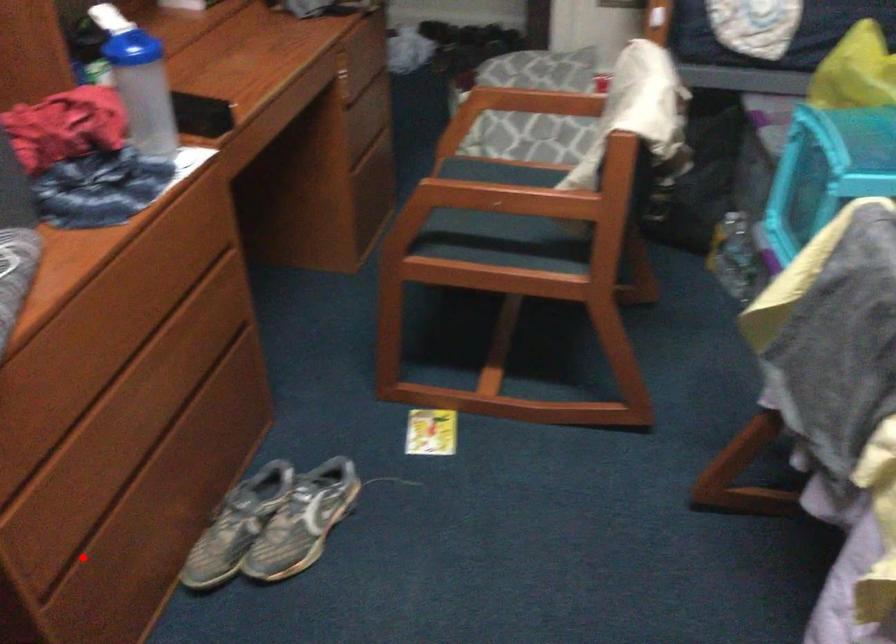
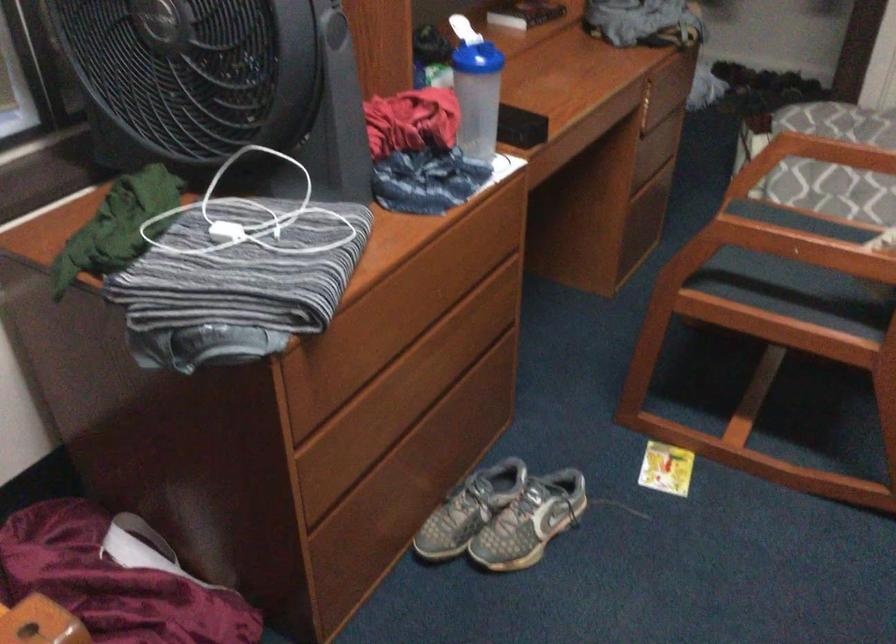
Question: I am providing you with two images of the same scene from different viewpoints. A red point is shown in image1. For the corresponding object point in image2, is it positioned nearer or farther from the camera?

Choices:
 (A) Nearer
 (B) Farther

Answer: (B)